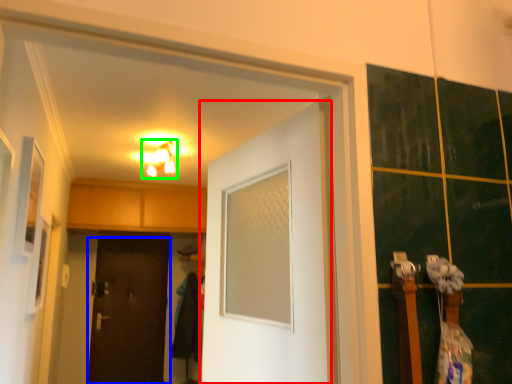
Question: Which object is positioned closest to door (highlighted by a red box)? Select from door (highlighted by a blue box) and light fixture (highlighted by a green box).

Choices:
 (A) door
 (B) light fixture

Answer: (B)